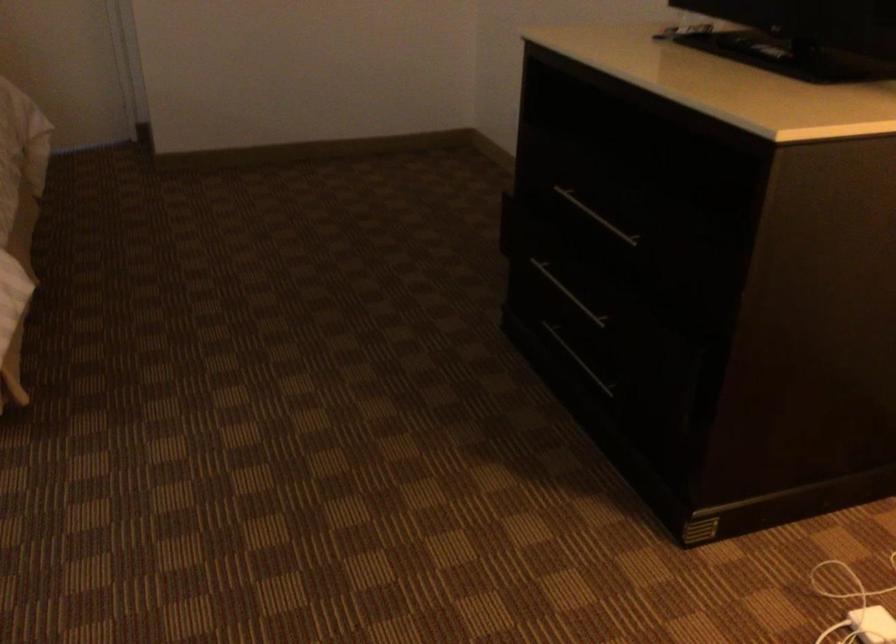
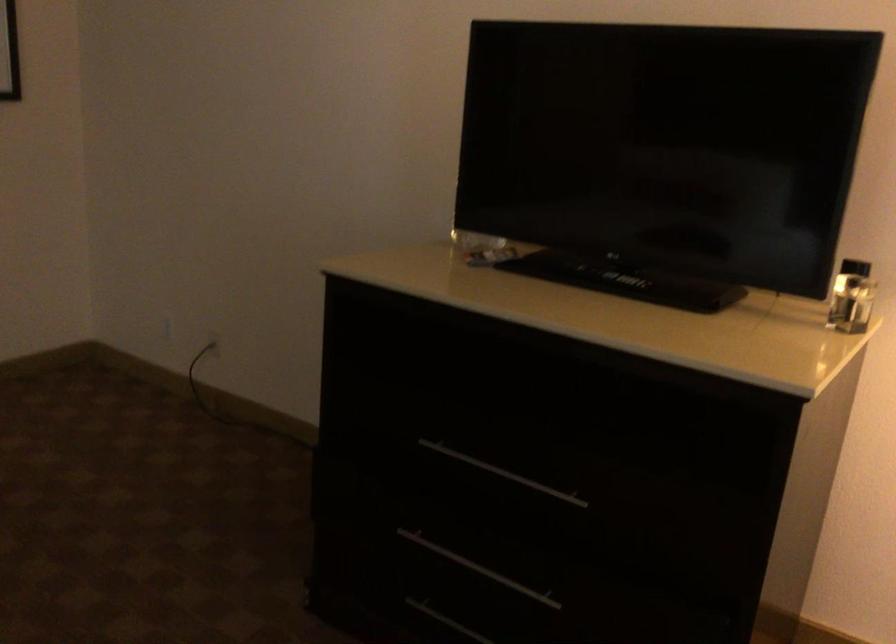
Locate, in the second image, the point that corresponds to [570,292] in the first image.

(478, 567)